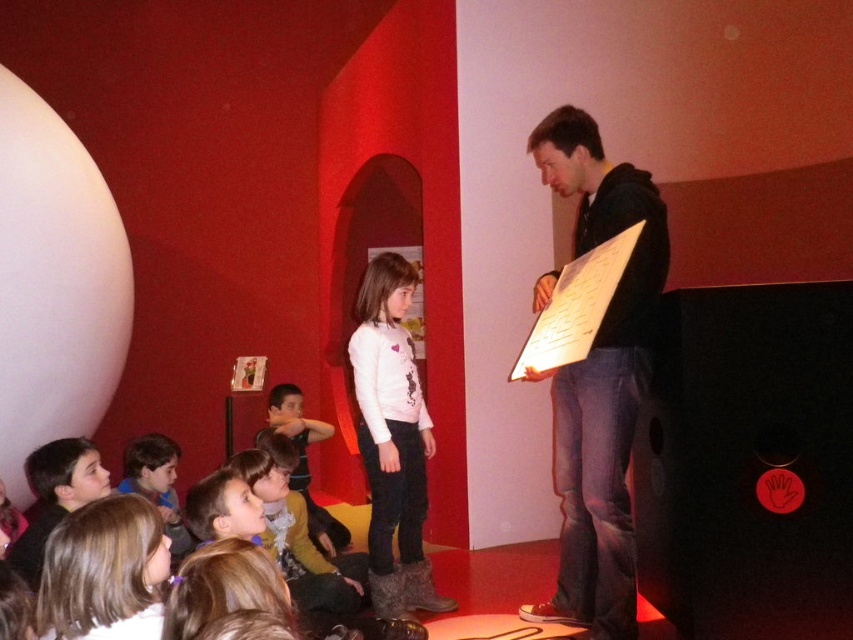
You are a photographer trying to capture both the black hoodie at upper right and the smooth white shirt at lower left in a single frame. Given their sizes, which one should you focus on to ensure both are clearly visible?

The black hoodie at upper right is larger in size compared to the smooth white shirt at lower left, so focusing on the black hoodie at upper right would allow both to be visible while maintaining clarity.

Consider the image. You are a teacher in a classroom with a black matte speaker at center and a matte brown jacket at center. You need to move a 3.5 feet wide box from the speaker to the jacket. Is there enough space between them for the box to fit through?

The black matte speaker at center is 5.87 feet away from the matte brown jacket at center. Since the box is 3.5 feet wide, there is sufficient space between them to move the box through.

You are a photographer standing in the room and want to take a photo that includes both the smooth white shirt at lower left and the matte brown jacket at center. Which object should you position closer to the left side of the camera frame?

You should position the matte brown jacket at center closer to the left side of the camera frame because the smooth white shirt at lower left is to the right of it.